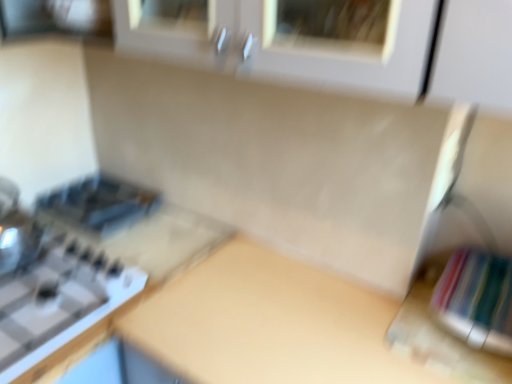
The image size is (512, 384). In order to click on white glossy gas stove at left in this screenshot , I will do `click(59, 304)`.

Measure the distance between point (x=256, y=327) and camera.

Point (x=256, y=327) is 93.90 centimeters away from camera.

Locate an element on the screen. satin black toaster at left is located at coordinates (99, 204).

Where is `white glossy gas stove at left`? The image size is (512, 384). white glossy gas stove at left is located at coordinates (59, 304).

From a real-world perspective, is white glossy gas stove at left positioned under satin black toaster at left based on gravity?

Correct, in the physical world, white glossy gas stove at left is lower than satin black toaster at left.

I want to click on gas stove directly beneath the satin black toaster at left (from a real-world perspective), so click(59, 304).

Does point (67, 344) come closer to viewer compared to point (123, 221)?

Yes, point (67, 344) is closer to viewer.

From their relative heights in the image, would you say white glossy gas stove at left is taller or shorter than satin black toaster at left?

Considering their sizes, white glossy gas stove at left has less height than satin black toaster at left.

Is white glossy gas stove at left oriented towards beige matte counter top at center?

No, white glossy gas stove at left is not aimed at beige matte counter top at center.

From the image's perspective, is white glossy gas stove at left above beige matte counter top at center?

Yes, from the image's perspective, white glossy gas stove at left is over beige matte counter top at center.

How far apart are white glossy gas stove at left and beige matte counter top at center?

white glossy gas stove at left and beige matte counter top at center are 10.09 inches apart.

Between point (89, 298) and point (216, 377), which one is positioned in front?

The point (216, 377) is in front.

Is satin black toaster at left further to camera compared to beige matte counter top at center?

Yes, it is.

Is satin black toaster at left surrounding beige matte counter top at center?

That's incorrect, beige matte counter top at center is not inside satin black toaster at left.

Which of these two, satin black toaster at left or beige matte counter top at center, is bigger?

beige matte counter top at center is bigger.

Does beige matte counter top at center turn towards satin black toaster at left?

No, beige matte counter top at center is not aimed at satin black toaster at left.

Is point (170, 312) farther from camera compared to point (100, 216)?

No, it is in front of (100, 216).

From a real-world perspective, which is physically above, beige matte counter top at center or satin black toaster at left?

In real-world perspective, satin black toaster at left is above.

Is satin black toaster at left located within beige matte counter top at center?

No, beige matte counter top at center does not contain satin black toaster at left.

Could you tell me if beige matte counter top at center is turned towards white glossy gas stove at left?

No.

Between beige matte counter top at center and white glossy gas stove at left, which one is positioned behind?

white glossy gas stove at left is further from the camera.

From the image's perspective, is beige matte counter top at center located above or below white glossy gas stove at left?

Clearly, from the image's perspective, beige matte counter top at center is below white glossy gas stove at left.

At what (x,y) coordinates should I click in order to perform the action: click on gas stove on the left of satin black toaster at left. Please return your answer as a coordinate pair (x, y). This screenshot has height=384, width=512. Looking at the image, I should click on (59, 304).

From the image's perspective, is satin black toaster at left above or below white glossy gas stove at left?

From the image's perspective, satin black toaster at left appears above white glossy gas stove at left.

Between satin black toaster at left and white glossy gas stove at left, which one has smaller size?

satin black toaster at left is smaller.

Are satin black toaster at left and white glossy gas stove at left beside each other?

No, satin black toaster at left is not making contact with white glossy gas stove at left.

Where is `appliance located above the white glossy gas stove at left (from the image's perspective)`? The height and width of the screenshot is (384, 512). appliance located above the white glossy gas stove at left (from the image's perspective) is located at coordinates (99, 204).

Where is `counter top that appears on the right of white glossy gas stove at left`? counter top that appears on the right of white glossy gas stove at left is located at coordinates (268, 323).

Based on their spatial positions, is satin black toaster at left or beige matte counter top at center closer to white glossy gas stove at left?

Based on the image, beige matte counter top at center appears to be nearer to white glossy gas stove at left.

From the picture: Based on their spatial positions, is satin black toaster at left or white glossy gas stove at left closer to beige matte counter top at center?

white glossy gas stove at left.

When comparing their distances from satin black toaster at left, does beige matte counter top at center or white glossy gas stove at left seem closer?

The object closer to satin black toaster at left is white glossy gas stove at left.

Looking at the image, which one is located closer to satin black toaster at left, white glossy gas stove at left or beige matte counter top at center?

white glossy gas stove at left is closer to satin black toaster at left.

Which object lies nearer to the anchor point white glossy gas stove at left, beige matte counter top at center or satin black toaster at left?

The object closer to white glossy gas stove at left is beige matte counter top at center.

Looking at the image, which one is located further to beige matte counter top at center, white glossy gas stove at left or satin black toaster at left?

satin black toaster at left lies further to beige matte counter top at center than the other object.

The height and width of the screenshot is (384, 512). I want to click on appliance situated between white glossy gas stove at left and beige matte counter top at center from left to right, so click(x=99, y=204).